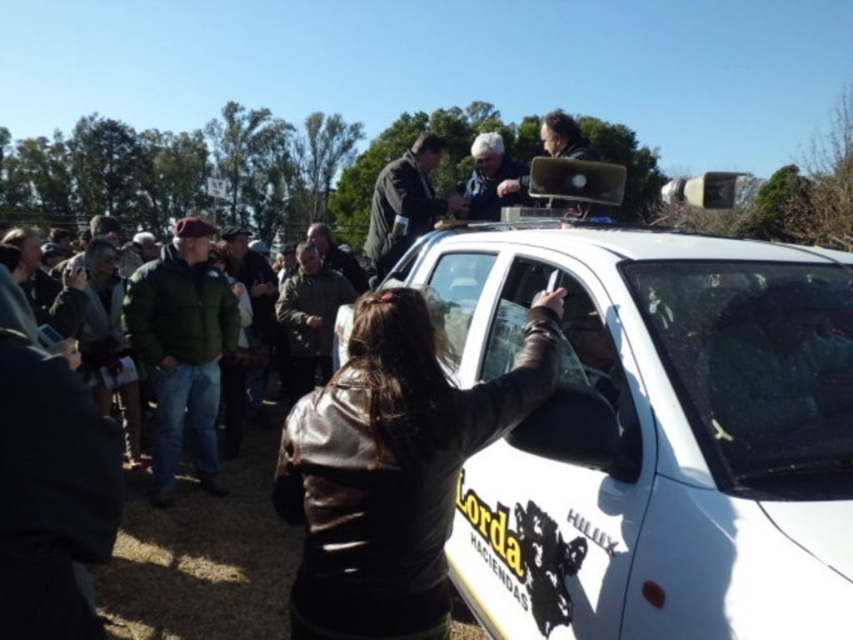
Question: Does white matte car at center have a smaller size compared to green fuzzy jacket at left?

Choices:
 (A) no
 (B) yes

Answer: (A)

Question: Which point is farther to the camera?

Choices:
 (A) dark brown leather jacket at center
 (B) matte black laptop at upper center
 (C) green fuzzy jacket at lower left
 (D) white matte car at center

Answer: (A)

Question: Does white matte car at center appear on the right side of green fuzzy jacket at lower left?

Choices:
 (A) no
 (B) yes

Answer: (B)

Question: Among these objects, which one is nearest to the camera?

Choices:
 (A) white matte car at center
 (B) matte black laptop at upper center

Answer: (A)

Question: Which point is farther from the camera taking this photo?

Choices:
 (A) [x=531, y=202]
 (B) [x=177, y=442]

Answer: (A)

Question: Does white matte car at center have a larger size compared to leather jacket at center?

Choices:
 (A) no
 (B) yes

Answer: (B)